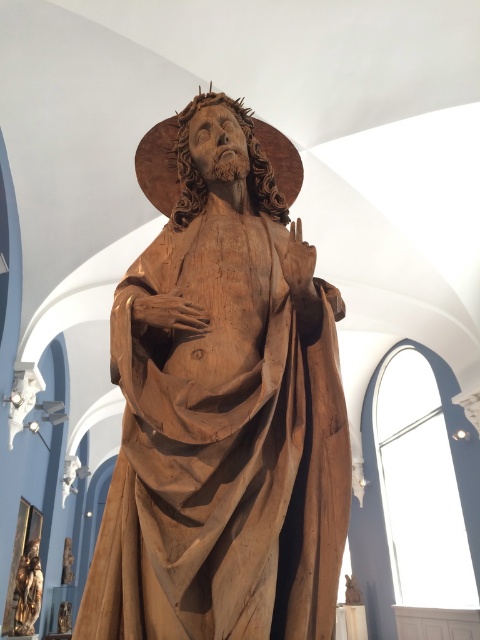
You are an art conservator standing 1.5 meters away from the wooden statue at center. You need to reach the halo above its head for restoration. Can you do this without moving closer?

The wooden statue at center is 2.07 meters away from the camera. Since you are standing 1.5 meters away, you are closer than the camera. Therefore, you can reach the halo above its head without needing to move closer.

You are an art curator planning to display both the wooden statue at center and the gold polished statue at lower left in a new exhibition. Given their sizes, which statue should be placed on the higher pedestal to ensure they appear balanced in height?

The wooden statue at center is taller than the gold polished statue at lower left, so to balance their heights, the gold polished statue at lower left should be placed on a higher pedestal than the wooden statue at center.